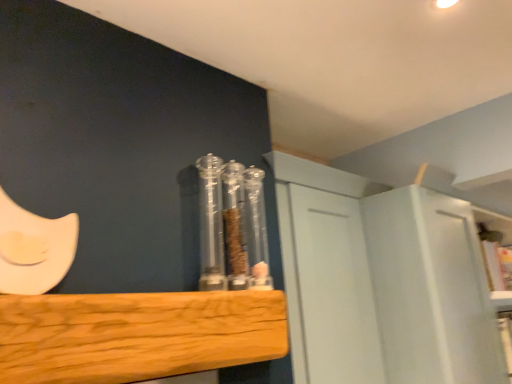
This screenshot has width=512, height=384. Describe the element at coordinates (232, 226) in the screenshot. I see `transparent plastic containers at center` at that location.

Identify the location of transparent plastic containers at center. (232, 226).

Image resolution: width=512 pixels, height=384 pixels. What do you see at coordinates (382, 281) in the screenshot? I see `white matte cabinet at upper right` at bounding box center [382, 281].

Measure the distance between point (490, 348) and camera.

The depth of point (490, 348) is 1.76 meters.

Locate an element on the screen. transparent plastic containers at center is located at coordinates (232, 226).

Can you confirm if transparent plastic containers at center is wider than white matte cabinet at upper right?

Incorrect, the width of transparent plastic containers at center does not surpass that of white matte cabinet at upper right.

Can you confirm if transparent plastic containers at center is positioned to the left of white matte cabinet at upper right?

Yes, transparent plastic containers at center is to the left of white matte cabinet at upper right.

Is transparent plastic containers at center outside of white matte cabinet at upper right?

Yes, transparent plastic containers at center is not within white matte cabinet at upper right.

Can you confirm if transparent plastic containers at center is shorter than white matte cabinet at upper right?

Yes.

Which is behind, point (207, 310) or point (392, 346)?

Positioned behind is point (392, 346).

Is the depth of natural wood plank at center less than that of white matte cabinet at upper right?

Yes.

From a real-world perspective, who is located lower, natural wood plank at center or white matte cabinet at upper right?

From a 3D spatial view, white matte cabinet at upper right is below.

From the image's perspective, which is above, natural wood plank at center or white matte cabinet at upper right?

natural wood plank at center, from the image's perspective.

From a real-world perspective, is white matte cabinet at upper right physically below natural wood plank at center?

Correct, in the physical world, white matte cabinet at upper right is lower than natural wood plank at center.

Is white matte cabinet at upper right touching natural wood plank at center?

No, white matte cabinet at upper right is not beside natural wood plank at center.

Considering the positions of points (349, 265) and (214, 363), is point (349, 265) farther from camera compared to point (214, 363)?

Yes, it is behind point (214, 363).

Is natural wood plank at center at the back of white matte cabinet at upper right?

white matte cabinet at upper right does not have its back to natural wood plank at center.

The width and height of the screenshot is (512, 384). What are the coordinates of `cabinetry on the right of the transparent plastic containers at center` in the screenshot? It's located at (382, 281).

Considering their positions, is white matte cabinet at upper right located in front of or behind transparent plastic containers at center?

white matte cabinet at upper right is behind transparent plastic containers at center.

Which of these two, white matte cabinet at upper right or transparent plastic containers at center, is bigger?

With larger size is white matte cabinet at upper right.

Is transparent plastic containers at center inside natural wood plank at center?

No, transparent plastic containers at center is not inside natural wood plank at center.

Is the depth of natural wood plank at center greater than that of transparent plastic containers at center?

No, the depth of natural wood plank at center is less than that of transparent plastic containers at center.

In order to click on furniture below the transparent plastic containers at center (from a real-world perspective) in this screenshot , I will do `click(136, 335)`.

Between natural wood plank at center and transparent plastic containers at center, which one has smaller width?

With smaller width is transparent plastic containers at center.

Considering the relative sizes of transparent plastic containers at center and natural wood plank at center in the image provided, is transparent plastic containers at center smaller than natural wood plank at center?

Indeed, transparent plastic containers at center has a smaller size compared to natural wood plank at center.

Which of these two, transparent plastic containers at center or natural wood plank at center, is wider?

Wider between the two is natural wood plank at center.

Does transparent plastic containers at center appear on the right side of natural wood plank at center?

Yes, transparent plastic containers at center is to the right of natural wood plank at center.

Based on the photo, would you say transparent plastic containers at center is outside natural wood plank at center?

Yes, transparent plastic containers at center is outside of natural wood plank at center.

Image resolution: width=512 pixels, height=384 pixels. In order to click on cabinetry directly beneath the transparent plastic containers at center (from a real-world perspective) in this screenshot , I will do [x=382, y=281].

Image resolution: width=512 pixels, height=384 pixels. I want to click on cabinetry to the right of natural wood plank at center, so click(x=382, y=281).

Based on their spatial positions, is transparent plastic containers at center or natural wood plank at center closer to white matte cabinet at upper right?

Based on the image, transparent plastic containers at center appears to be nearer to white matte cabinet at upper right.

When comparing their distances from white matte cabinet at upper right, does natural wood plank at center or transparent plastic containers at center seem closer?

transparent plastic containers at center is closer to white matte cabinet at upper right.

Consider the image. Looking at the image, which one is located further to transparent plastic containers at center, white matte cabinet at upper right or natural wood plank at center?

white matte cabinet at upper right is positioned further to the anchor transparent plastic containers at center.

From the image, which object appears to be farther from natural wood plank at center, transparent plastic containers at center or white matte cabinet at upper right?

white matte cabinet at upper right is further to natural wood plank at center.

Estimate the real-world distances between objects in this image. Which object is closer to natural wood plank at center, white matte cabinet at upper right or transparent plastic containers at center?

transparent plastic containers at center is positioned closer to the anchor natural wood plank at center.

Which object lies further to the anchor point transparent plastic containers at center, natural wood plank at center or white matte cabinet at upper right?

Based on the image, white matte cabinet at upper right appears to be further to transparent plastic containers at center.

Find the location of a particular element. glass jar located between natural wood plank at center and white matte cabinet at upper right in the left-right direction is located at coordinates (232, 226).